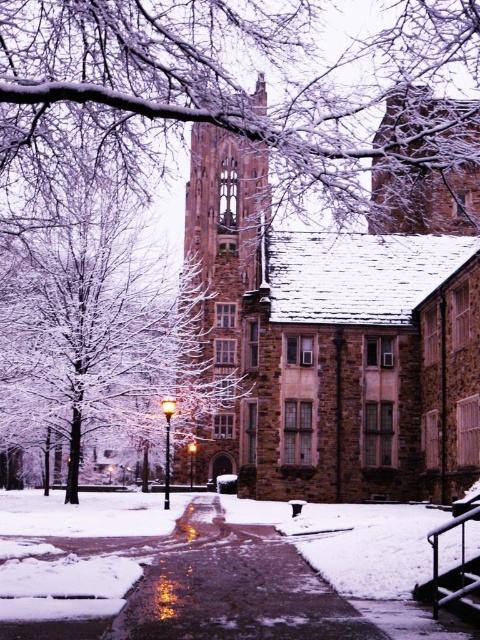
Which is in front, point (433, 348) or point (182, 52)?

Positioned in front is point (182, 52).

Is brown stone church at center positioned at the back of snow-covered branches at upper center?

Yes, it is behind snow-covered branches at upper center.

Identify the location of brown stone church at center. (337, 333).

Locate an element on the screen. This screenshot has width=480, height=640. brown stone church at center is located at coordinates (337, 333).